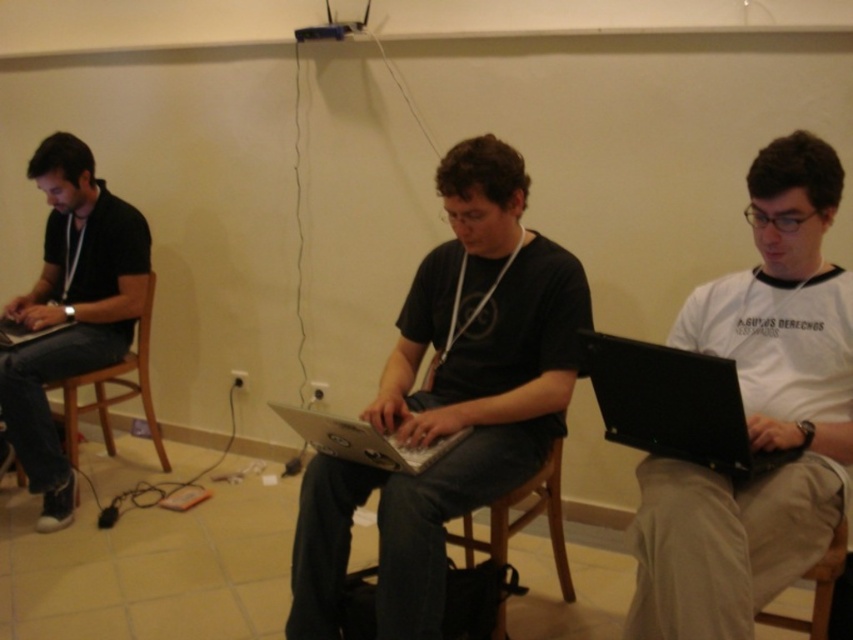
Can you confirm if brown wooden chair at left is bigger than matte black laptop at left?

Yes, brown wooden chair at left is bigger than matte black laptop at left.

Does brown wooden chair at left lie in front of matte black laptop at left?

No.

Consider the image. Who is more forward, (x=119, y=371) or (x=16, y=330)?

Point (x=16, y=330)

I want to click on brown wooden chair at left, so click(x=115, y=394).

Is the position of wooden chair at center less distant than that of silver metallic laptop at center?

No, it is behind silver metallic laptop at center.

Is point (561, 442) more distant than point (421, 465)?

Yes, it is behind point (421, 465).

Identify the location of wooden chair at center. (503, 554).

Is black matte laptop at center above black glossy laptop at right?

No.

Can you confirm if black matte laptop at center is wider than black glossy laptop at right?

Indeed, black matte laptop at center has a greater width compared to black glossy laptop at right.

The width and height of the screenshot is (853, 640). I want to click on black matte laptop at center, so click(x=450, y=397).